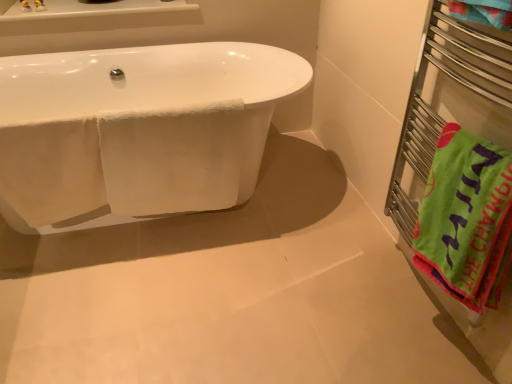
Where is `space that is in front of white glossy bathtub at left`? The image size is (512, 384). space that is in front of white glossy bathtub at left is located at coordinates (158, 306).